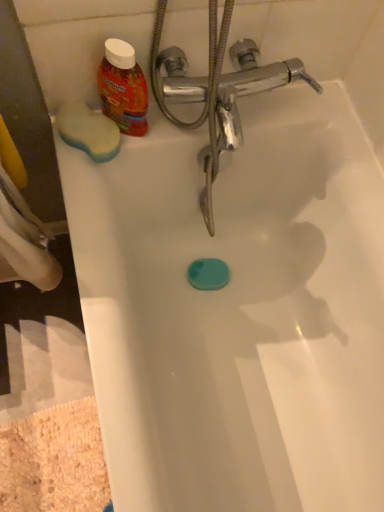
What is the approximate height of matte plastic bottle at upper left?

It is 16.15 centimeters.

The height and width of the screenshot is (512, 384). Describe the element at coordinates (123, 88) in the screenshot. I see `matte plastic bottle at upper left` at that location.

Locate an element on the screen. Image resolution: width=384 pixels, height=512 pixels. matte plastic bottle at upper left is located at coordinates (123, 88).

Where is `matte plastic bottle at upper left`? The image size is (384, 512). matte plastic bottle at upper left is located at coordinates (123, 88).